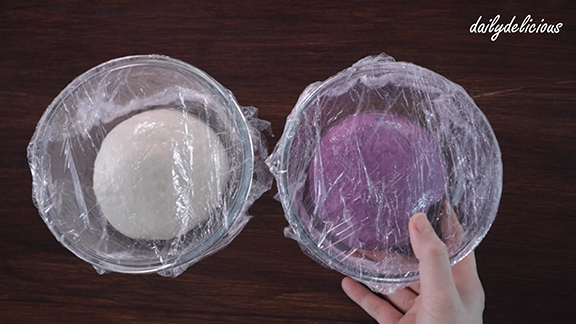
You are a GUI agent. You are given a task and a screenshot of the screen. Output one action in this format:
    pyautogui.click(x=<x>, y=<y>)
    Task: Click on the right bowl
    Image resolution: width=576 pixels, height=324 pixels.
    Given the screenshot: What is the action you would take?
    pyautogui.click(x=373, y=151)